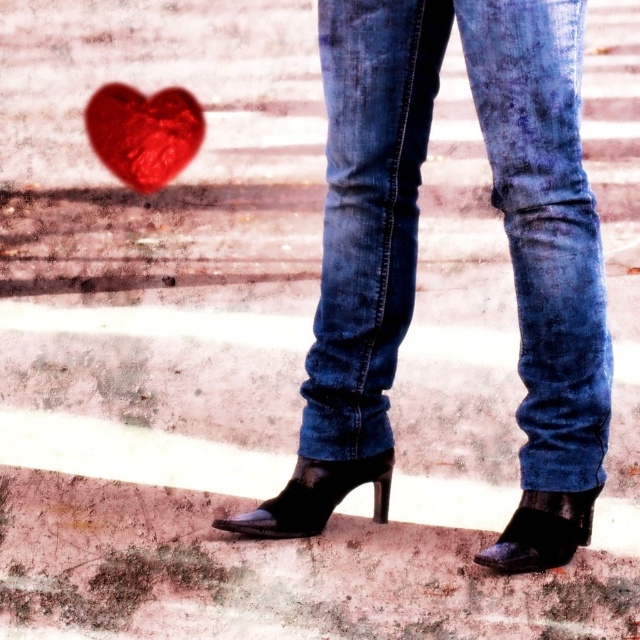
You are trying to decide whether to place a small sticker on your denim jeans at center or the shiny red heart at upper left. Based on their sizes, which object would the sticker fit better on?

The sticker would fit better on the denim jeans at center since it is larger in size than the shiny red heart at upper left.

You are a drone operator trying to deliver a small package to the shiny red heart at upper left. Your drone has a maximum delivery range of 2 meters. Can you deliver the package from the position where the denim jeans at center are located?

The distance between the denim jeans at center and the shiny red heart at upper left is 2.16 meters, which exceeds the drone delivery range of 2 meters. Therefore, the drone cannot deliver the package from the denim jeans at center to the shiny red heart at upper left.